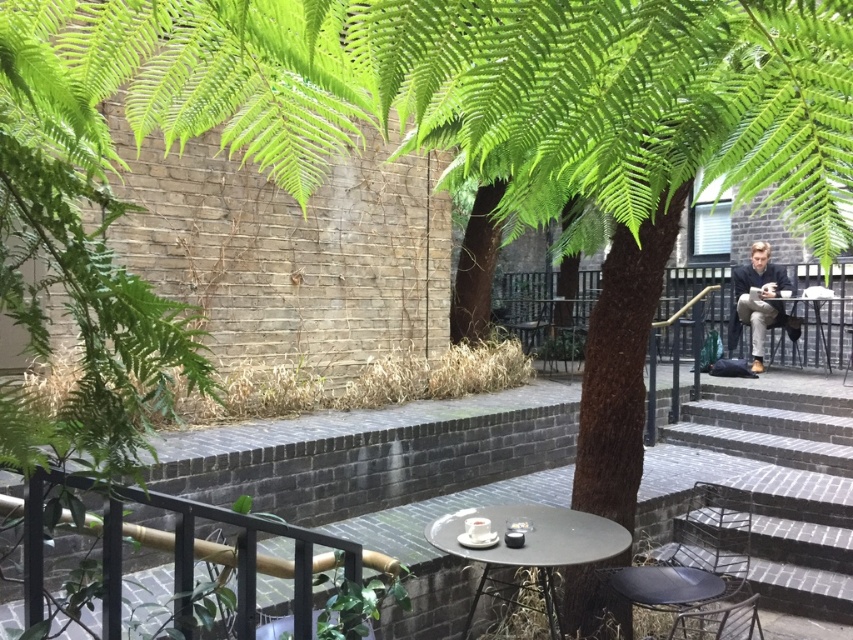
Question: Is metallic gray chair at lower right to the right of metallic silver chair at center from the viewer's perspective?

Choices:
 (A) no
 (B) yes

Answer: (B)

Question: Which of these objects is positioned farthest from the metallic gray table at center?

Choices:
 (A) metallic silver table at right
 (B) metallic silver chair at center
 (C) metallic gray chair at lower right
 (D) metallic black chair at lower right

Answer: (A)

Question: Does metallic gray table at center have a lesser width compared to metallic silver chair at center?

Choices:
 (A) no
 (B) yes

Answer: (A)

Question: Can you confirm if metallic black chair at lower right is smaller than metallic gray table at center?

Choices:
 (A) no
 (B) yes

Answer: (A)

Question: Which object is closer to the camera taking this photo?

Choices:
 (A) metallic black chair at lower right
 (B) metallic silver table at right

Answer: (A)

Question: Which point appears farthest from the camera in this image?

Choices:
 (A) (509, 504)
 (B) (718, 404)
 (C) (689, 600)

Answer: (B)